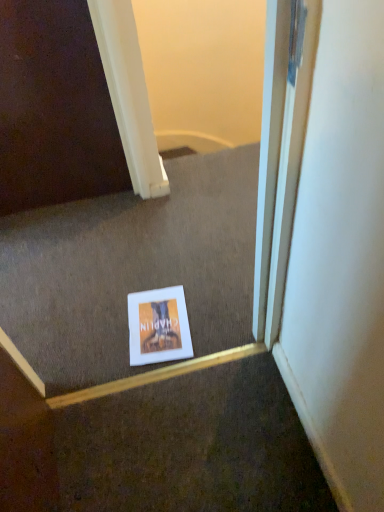
I want to click on vacant space positioned to the left of matte cardboard book at center, so [95, 333].